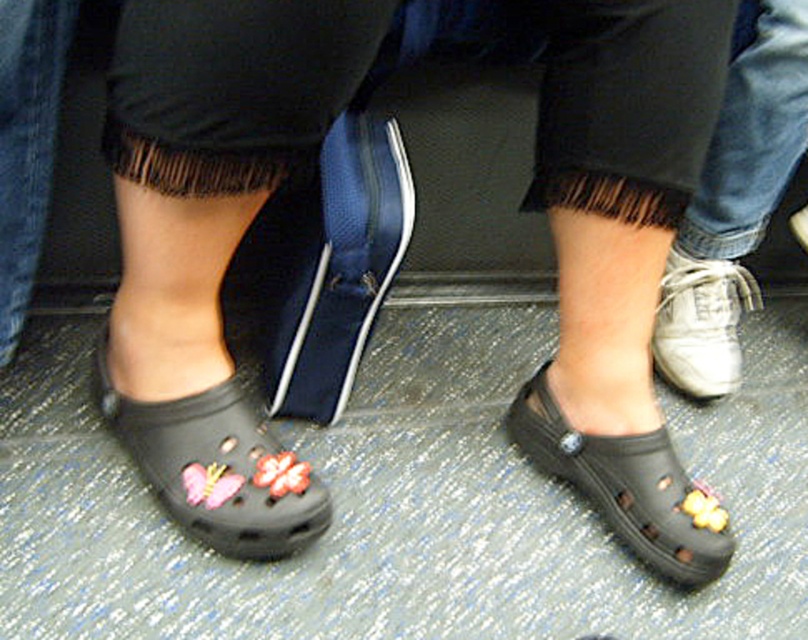
Does white leather shoe at lower right appear on the right side of black rubber clog at lower center?

Correct, you'll find white leather shoe at lower right to the right of black rubber clog at lower center.

Between white leather shoe at lower right and black rubber clog at lower center, which one appears on the left side from the viewer's perspective?

From the viewer's perspective, black rubber clog at lower center appears more on the left side.

Who is more distant from viewer, (752, 36) or (621, 461)?

The point (752, 36) is behind.

Locate an element on the screen. white leather shoe at lower right is located at coordinates (734, 200).

Between white leather shoe at lower right and matte black croc at lower left, which one is positioned higher?

Positioned higher is white leather shoe at lower right.

What do you see at coordinates (734, 200) in the screenshot? Image resolution: width=808 pixels, height=640 pixels. I see `white leather shoe at lower right` at bounding box center [734, 200].

Who is more distant from viewer, (792, 145) or (179, 496)?

The point (792, 145) is more distant.

Where is `white leather shoe at lower right`? This screenshot has height=640, width=808. white leather shoe at lower right is located at coordinates (734, 200).

Between white leather shoe at lower right and white leather sneaker at right, which one appears on the right side from the viewer's perspective?

From the viewer's perspective, white leather shoe at lower right appears more on the right side.

At what (x,y) coordinates should I click in order to perform the action: click on white leather shoe at lower right. Please return your answer as a coordinate pair (x, y). The image size is (808, 640). Looking at the image, I should click on (734, 200).

The width and height of the screenshot is (808, 640). Identify the location of white leather shoe at lower right. (734, 200).